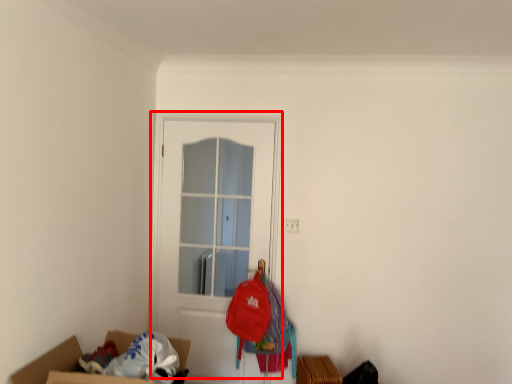
Question: From the image's perspective, considering the relative positions of door (annotated by the red box) and clothing in the image provided, where is door (annotated by the red box) located with respect to the staircase?

Choices:
 (A) below
 (B) above

Answer: (B)